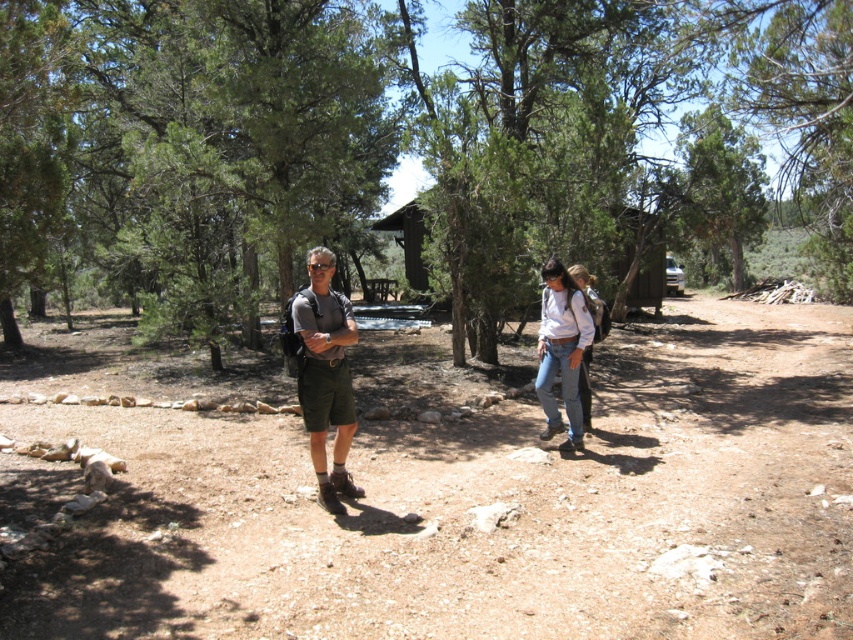
You are a photographer standing on the dirt path in the forest. You want to take a photo of both the matte khaki shorts at center and the jeans at center. Which clothing item should you focus on first to ensure both are in sharp focus?

You should focus on the matte khaki shorts at center first because it is closer to the viewer than the jeans at center. By focusing on the closer object, the farther one may still be in the depth of field, ensuring both are sharp.

You are standing at the point marked as point [402,144] in the image. Which object is directly in front of you?

The green leafy tree at center is located at point [402,144], so the object directly in front of you is the green leafy tree at center.

You are a photographer trying to capture a closeup of the matte khaki shorts at center and the jeans at center. Which item has a larger width when viewed from your current position?

The matte khaki shorts at center might be wider than jeans at center, so the matte khaki shorts at center has a larger width when viewed from your current position.